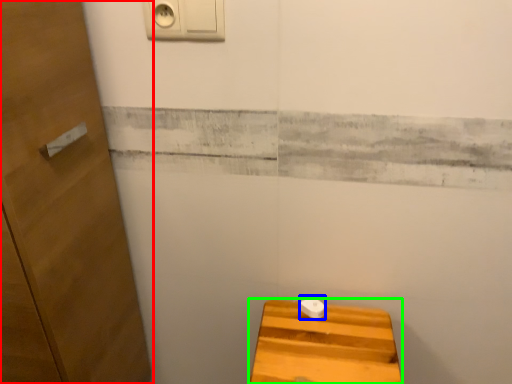
Question: Based on their relative distances, which object is farther from door (highlighted by a red box)? Choose from knob (highlighted by a blue box) and furniture (highlighted by a green box).

Choices:
 (A) knob
 (B) furniture

Answer: (A)